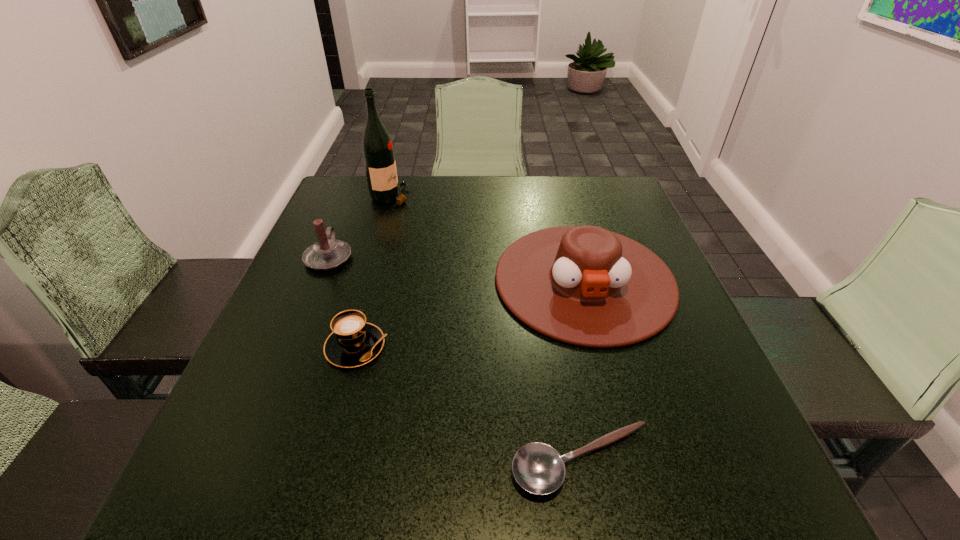
You are a GUI agent. You are given a task and a screenshot of the screen. Output one action in this format:
    pyautogui.click(x=<x>, y=<y>)
    Task: Click on the farthest object
    The height and width of the screenshot is (540, 960).
    Given the screenshot: What is the action you would take?
    pyautogui.click(x=377, y=147)

Image resolution: width=960 pixels, height=540 pixels. I want to click on wine bottle, so click(x=377, y=147).

The height and width of the screenshot is (540, 960). I want to click on candle, so click(328, 253).

Where is `cowboy hat`? The width and height of the screenshot is (960, 540). cowboy hat is located at coordinates (584, 285).

You are a GUI agent. You are given a task and a screenshot of the screen. Output one action in this format:
    pyautogui.click(x=<x>, y=<y>)
    Task: Click on the second shortest object
    The height and width of the screenshot is (540, 960).
    Given the screenshot: What is the action you would take?
    pyautogui.click(x=354, y=342)

Where is `the shortest object`? The height and width of the screenshot is (540, 960). the shortest object is located at coordinates (538, 468).

This screenshot has height=540, width=960. I want to click on ladle, so click(538, 468).

At what (x,y) coordinates should I click in order to perform the action: click on vacant position located 0.100m on the surface of the wine bottle. Please return your answer as a coordinate pair (x, y). Looking at the image, I should click on (447, 196).

Find the location of a particular element. free space located on the side of the candle with the handle loop is located at coordinates (356, 190).

Where is `free space located 0.140m on the side of the candle with the handle loop`? The image size is (960, 540). free space located 0.140m on the side of the candle with the handle loop is located at coordinates (348, 211).